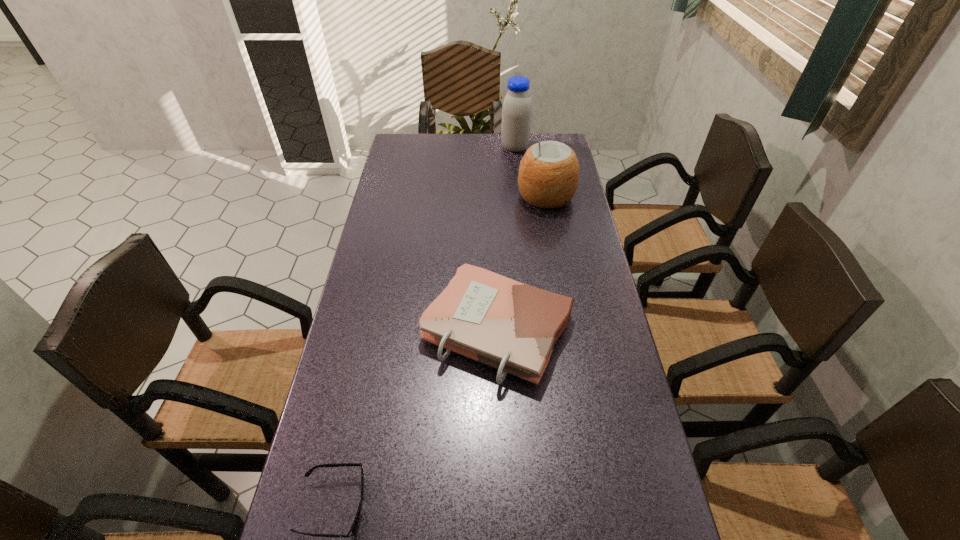
I want to click on the farthest object, so click(517, 106).

At what (x,y) coordinates should I click in order to perform the action: click on the second farthest object. Please return your answer as a coordinate pair (x, y). Looking at the image, I should click on (548, 176).

You are a GUI agent. You are given a task and a screenshot of the screen. Output one action in this format:
    pyautogui.click(x=<x>, y=<y>)
    Task: Click on the second shortest object
    Image resolution: width=960 pixels, height=540 pixels.
    Given the screenshot: What is the action you would take?
    pyautogui.click(x=513, y=327)

Locate an element on the screen. This screenshot has height=540, width=960. the third farthest object is located at coordinates (513, 327).

Where is `vacant region located on the left of the soya milk`? vacant region located on the left of the soya milk is located at coordinates (424, 148).

This screenshot has width=960, height=540. I want to click on free space located 0.070m on the front of the coconut, so click(x=551, y=228).

The image size is (960, 540). I want to click on free space located on the left of the phonebook, so click(x=345, y=329).

Where is `object that is at the far edge`? The width and height of the screenshot is (960, 540). object that is at the far edge is located at coordinates (517, 106).

This screenshot has height=540, width=960. I want to click on soya milk located at the right edge, so click(517, 106).

The image size is (960, 540). What are the coordinates of `coconut that is positioned at the right edge` in the screenshot? It's located at (548, 176).